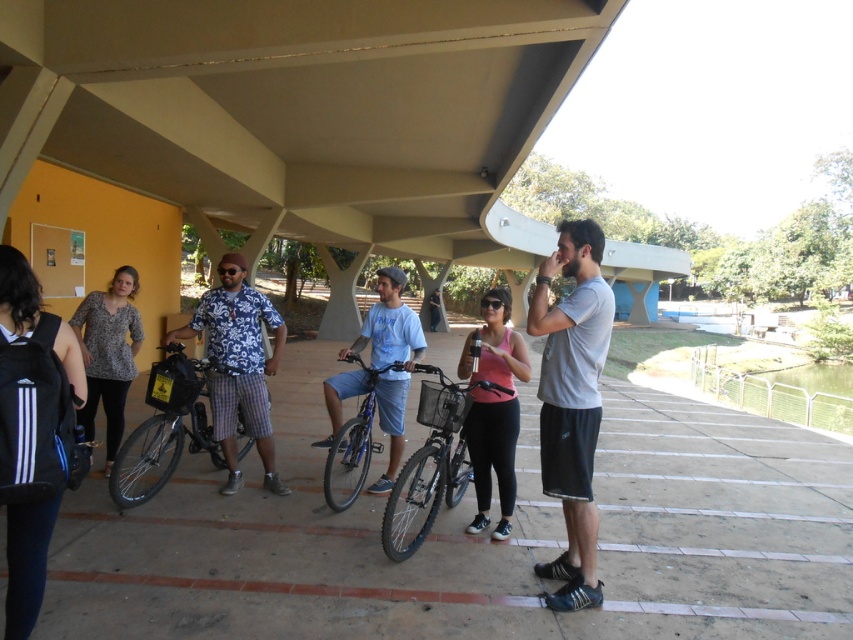
Describe the element at coordinates (432, 460) in the screenshot. I see `silver metallic bicycle at center` at that location.

Measure the distance between silver metallic bicycle at center and shiny blue bicycle at center.

silver metallic bicycle at center is 25.32 inches from shiny blue bicycle at center.

Where is `silver metallic bicycle at center`? silver metallic bicycle at center is located at coordinates (432, 460).

Does hawaiian shirt at center appear over silver metallic bicycle at center?

Correct, hawaiian shirt at center is located above silver metallic bicycle at center.

Is hawaiian shirt at center closer to the viewer compared to silver metallic bicycle at center?

No, hawaiian shirt at center is further to the viewer.

Who is more forward, (233, 284) or (405, 499)?

Point (405, 499) is more forward.

You are a GUI agent. You are given a task and a screenshot of the screen. Output one action in this format:
    pyautogui.click(x=<x>, y=<y>)
    Task: Click on the hawaiian shirt at center
    
    Given the screenshot: What is the action you would take?
    pyautogui.click(x=238, y=365)

Who is shorter, hawaiian shirt at center or shiny blue bicycle at center?

With less height is shiny blue bicycle at center.

Measure the distance between point (251, 385) and camera.

4.98 meters

Is point (213, 333) more distant than point (364, 374)?

No, (213, 333) is closer to viewer.

Find the location of `hawaiian shirt at center`. hawaiian shirt at center is located at coordinates (238, 365).